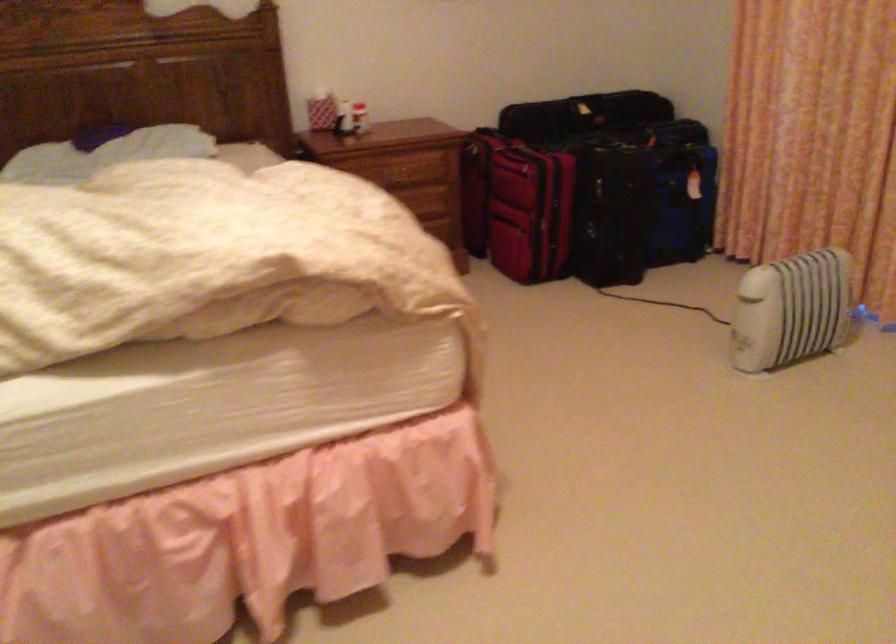
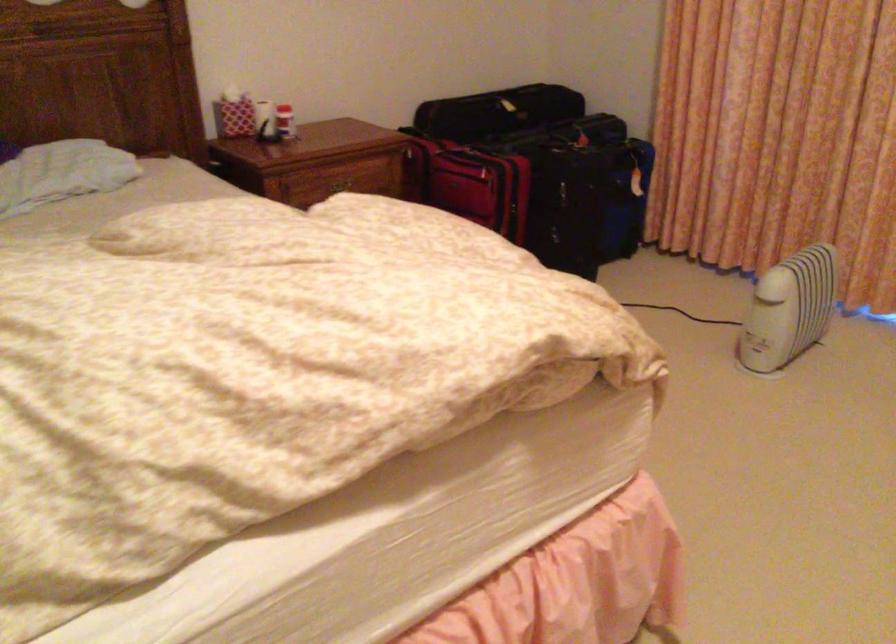
The point at (514, 175) is marked in the first image. Where is the corresponding point in the second image?

(469, 183)